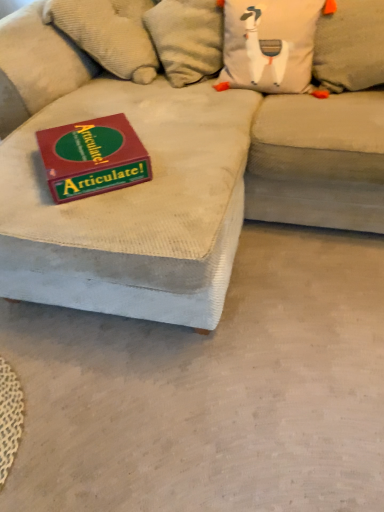
Question: Can you confirm if gray fabric pillow at upper right, the first pillow when ordered from right to left, is smaller than matte red box at upper left?

Choices:
 (A) yes
 (B) no

Answer: (B)

Question: Considering the relative sizes of gray fabric pillow at upper right, the 2th pillow in the left-to-right sequence, and matte red box at upper left in the image provided, is gray fabric pillow at upper right, the 2th pillow in the left-to-right sequence, taller than matte red box at upper left?

Choices:
 (A) yes
 (B) no

Answer: (A)

Question: Is gray fabric pillow at upper right, the first pillow when ordered from right to left, looking in the opposite direction of matte red box at upper left?

Choices:
 (A) no
 (B) yes

Answer: (A)

Question: Are gray fabric pillow at upper right, the first pillow when ordered from right to left, and matte red box at upper left located far from each other?

Choices:
 (A) no
 (B) yes

Answer: (A)

Question: Is matte red box at upper left inside gray fabric pillow at upper right, the first pillow when ordered from right to left?

Choices:
 (A) no
 (B) yes

Answer: (A)

Question: Is gray fabric pillow at upper right, the 2th pillow in the left-to-right sequence, oriented towards matte red box at upper left?

Choices:
 (A) no
 (B) yes

Answer: (A)

Question: Considering the relative sizes of gray fabric pillow at upper right, the first pillow when ordered from right to left, and white fabric pillow at upper center, which is counted as the 1th pillow, starting from the left, in the image provided, is gray fabric pillow at upper right, the first pillow when ordered from right to left, bigger than white fabric pillow at upper center, which is counted as the 1th pillow, starting from the left,?

Choices:
 (A) yes
 (B) no

Answer: (B)

Question: Considering the relative sizes of gray fabric pillow at upper right, the first pillow when ordered from right to left, and white fabric pillow at upper center, which is counted as the 1th pillow, starting from the left, in the image provided, is gray fabric pillow at upper right, the first pillow when ordered from right to left, taller than white fabric pillow at upper center, which is counted as the 1th pillow, starting from the left,?

Choices:
 (A) no
 (B) yes

Answer: (B)

Question: Does gray fabric pillow at upper right, the 2th pillow in the left-to-right sequence, have a greater width compared to white fabric pillow at upper center, which is counted as the 1th pillow, starting from the left?

Choices:
 (A) no
 (B) yes

Answer: (A)

Question: Does gray fabric pillow at upper right, the 2th pillow in the left-to-right sequence, lie in front of white fabric pillow at upper center, which is counted as the 1th pillow, starting from the left?

Choices:
 (A) yes
 (B) no

Answer: (A)

Question: From the image's perspective, does gray fabric pillow at upper right, the 2th pillow in the left-to-right sequence, appear higher than white fabric pillow at upper center, which is counted as the 1th pillow, starting from the left?

Choices:
 (A) yes
 (B) no

Answer: (B)

Question: Is gray fabric pillow at upper right, the 2th pillow in the left-to-right sequence, to the left of white fabric pillow at upper center, which is counted as the 1th pillow, starting from the left, from the viewer's perspective?

Choices:
 (A) yes
 (B) no

Answer: (B)

Question: Can you confirm if gray fabric pillow at upper right, the 2th pillow in the left-to-right sequence, is shorter than beige corduroy couch at center?

Choices:
 (A) no
 (B) yes

Answer: (B)